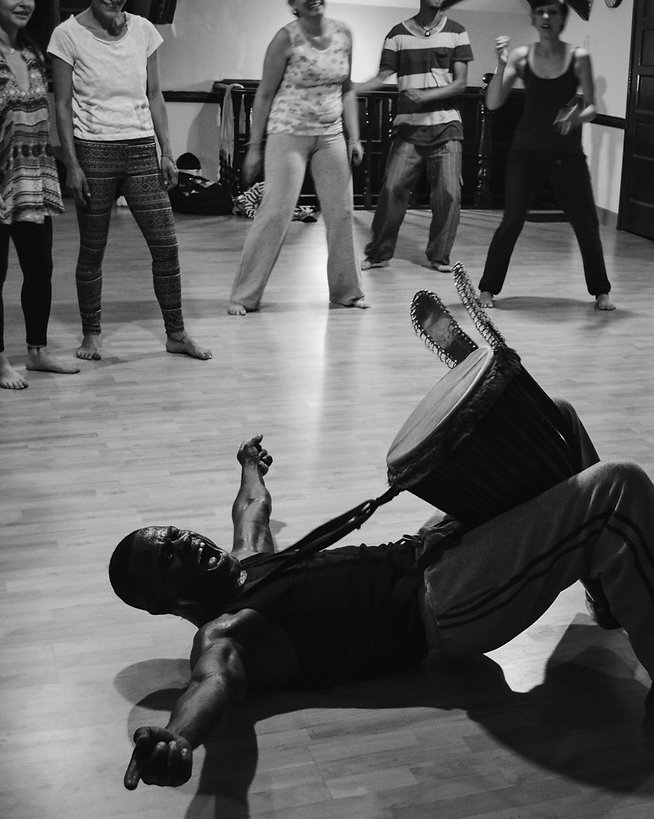
Find the location of a particular element. Image resolution: width=654 pixels, height=819 pixels. door is located at coordinates (641, 129).